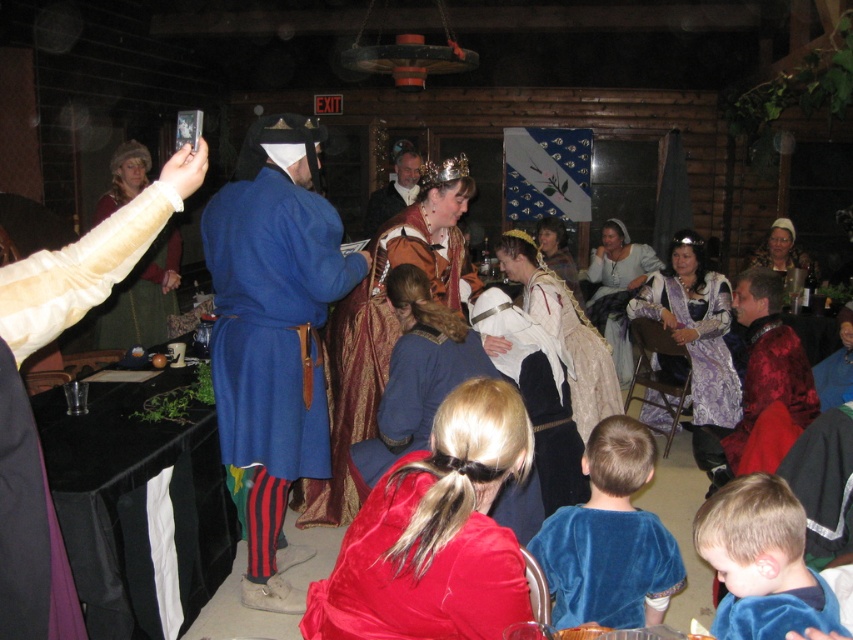
Question: Can you confirm if velvet red robe at center is positioned above smooth blue robe at center?

Choices:
 (A) yes
 (B) no

Answer: (B)

Question: Estimate the real-world distances between objects in this image. Which object is farther from the smooth blue robe at center?

Choices:
 (A) blue woolen robe at center
 (B) velvet blue robe at lower right
 (C) velvet red robe at center

Answer: (B)

Question: Is velvet red robe at center in front of velvet blue shirt at lower right?

Choices:
 (A) yes
 (B) no

Answer: (A)

Question: Which point is farther to the camera?

Choices:
 (A) (370, 214)
 (B) (746, 480)
 (C) (738, 600)

Answer: (A)

Question: Is velvet blue tunic at lower right further to camera compared to velvet blue shirt at lower right?

Choices:
 (A) no
 (B) yes

Answer: (B)

Question: Which of these objects is positioned farthest from the velvet blue robe at lower right?

Choices:
 (A) velvet blue shirt at lower right
 (B) velvet blue tunic at lower right
 (C) blue woolen robe at center
 (D) velvet red robe at center

Answer: (C)